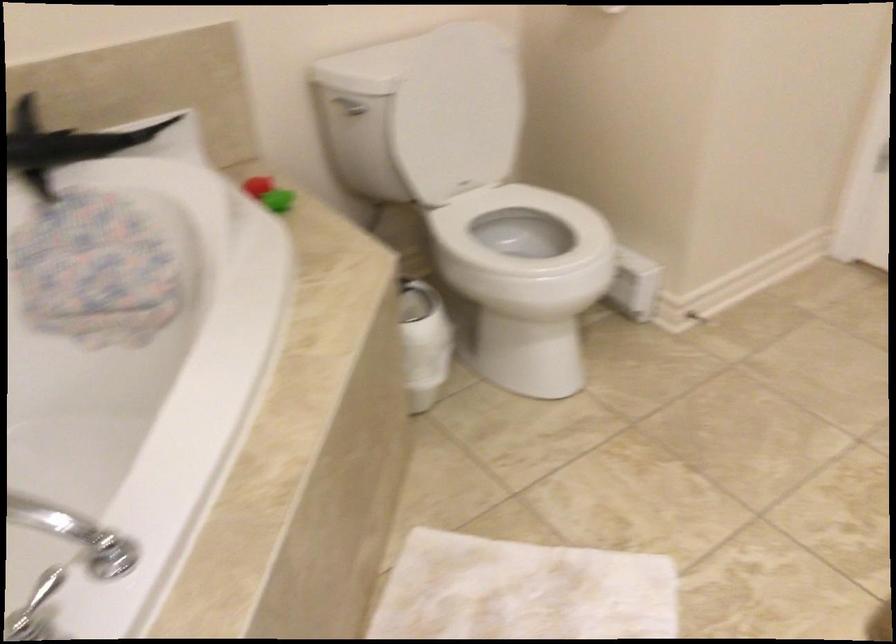
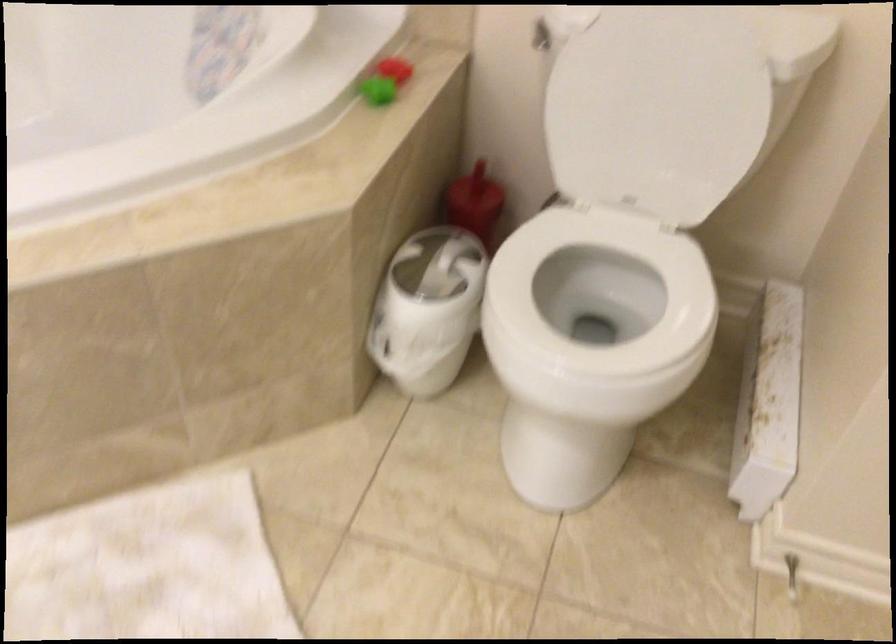
The point at (x=254, y=184) is marked in the first image. Where is the corresponding point in the second image?

(394, 69)